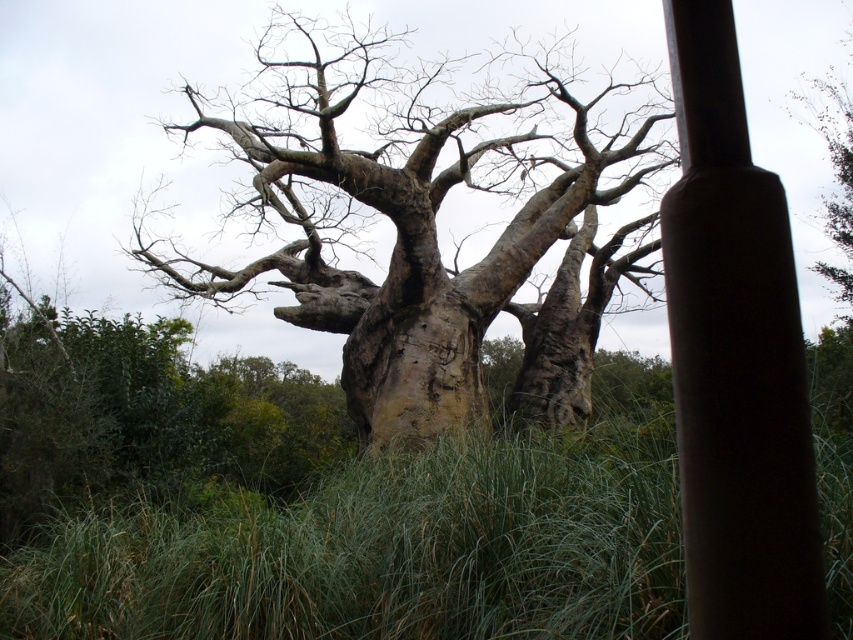
The height and width of the screenshot is (640, 853). What do you see at coordinates (393, 545) in the screenshot?
I see `green grassy at center` at bounding box center [393, 545].

Who is lower down, green grassy at center or smooth brown pole at right?

Positioned lower is green grassy at center.

Is point (679, 508) closer to camera compared to point (817, 579)?

No, it is behind (817, 579).

Where is `green grassy at center`? This screenshot has width=853, height=640. green grassy at center is located at coordinates (393, 545).

Does green grassy at center have a lesser width compared to smooth bark tree at center?

Incorrect, green grassy at center's width is not less than smooth bark tree at center's.

Between green grassy at center and smooth bark tree at center, which one is positioned lower?

green grassy at center

Between point (845, 525) and point (259, 150), which one is positioned in front?

Positioned in front is point (845, 525).

Locate an element on the screen. Image resolution: width=853 pixels, height=640 pixels. green grassy at center is located at coordinates (393, 545).

Consider the image. Does smooth bark tree at center appear over smooth brown pole at right?

Indeed, smooth bark tree at center is positioned over smooth brown pole at right.

Between smooth bark tree at center and smooth brown pole at right, which one is positioned lower?

smooth brown pole at right

Does point (471, 339) come behind point (682, 113)?

Yes, it is behind point (682, 113).

In order to click on smooth bark tree at center in this screenshot , I will do `click(433, 237)`.